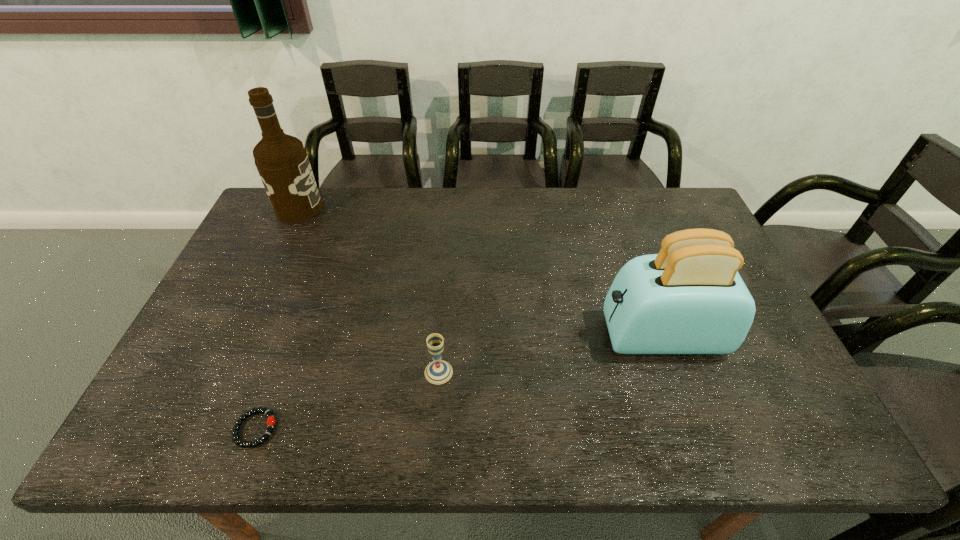
The height and width of the screenshot is (540, 960). Find the location of `empty space between the second object from left to right and the second tallest object`. empty space between the second object from left to right and the second tallest object is located at coordinates (458, 382).

Locate an element on the screen. free space between the chalice and the tallest object is located at coordinates 369,291.

Where is `empty space that is in between the second shortest object and the second tallest object`? This screenshot has width=960, height=540. empty space that is in between the second shortest object and the second tallest object is located at coordinates (550, 354).

Where is `vacant space in between the third tallest object and the second tallest object`? This screenshot has width=960, height=540. vacant space in between the third tallest object and the second tallest object is located at coordinates (550, 354).

You are a GUI agent. You are given a task and a screenshot of the screen. Output one action in this format:
    pyautogui.click(x=<x>, y=<y>)
    Task: Click on the object that stands as the closest to the second object from right to left
    This screenshot has height=540, width=960.
    Given the screenshot: What is the action you would take?
    pyautogui.click(x=270, y=422)

Select which object appears as the third closest to the second object from right to left. Please provide its 2D coordinates. Your answer should be formatted as a tuple, i.e. [(x, y)], where the tuple contains the x and y coordinates of a point satisfying the conditions above.

[(282, 162)]

Locate an element on the screen. This screenshot has height=540, width=960. vacant point that satisfies the following two spatial constraints: 1. on the back side of the nearest object; 2. on the label of the farthest object is located at coordinates (337, 208).

You are a GUI agent. You are given a task and a screenshot of the screen. Output one action in this format:
    pyautogui.click(x=<x>, y=<y>)
    Task: Click on the free space that satisfies the following two spatial constraints: 1. on the label of the tallest object; 2. on the right side of the shortest object
    This screenshot has height=540, width=960.
    Given the screenshot: What is the action you would take?
    pyautogui.click(x=197, y=429)

Locate an element on the screen. The height and width of the screenshot is (540, 960). vacant area in the image that satisfies the following two spatial constraints: 1. on the back side of the third tallest object; 2. on the label of the alcohol is located at coordinates (451, 208).

Where is `vacant space that satisfies the following two spatial constraints: 1. on the side of the second tallest object with the lever; 2. on the front side of the bracelet`? vacant space that satisfies the following two spatial constraints: 1. on the side of the second tallest object with the lever; 2. on the front side of the bracelet is located at coordinates (693, 429).